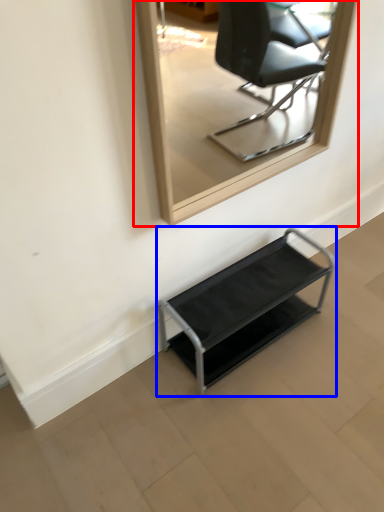
Question: Which point is closer to the camera, mirror (highlighted by a red box) or furniture (highlighted by a blue box)?

Choices:
 (A) mirror
 (B) furniture

Answer: (A)